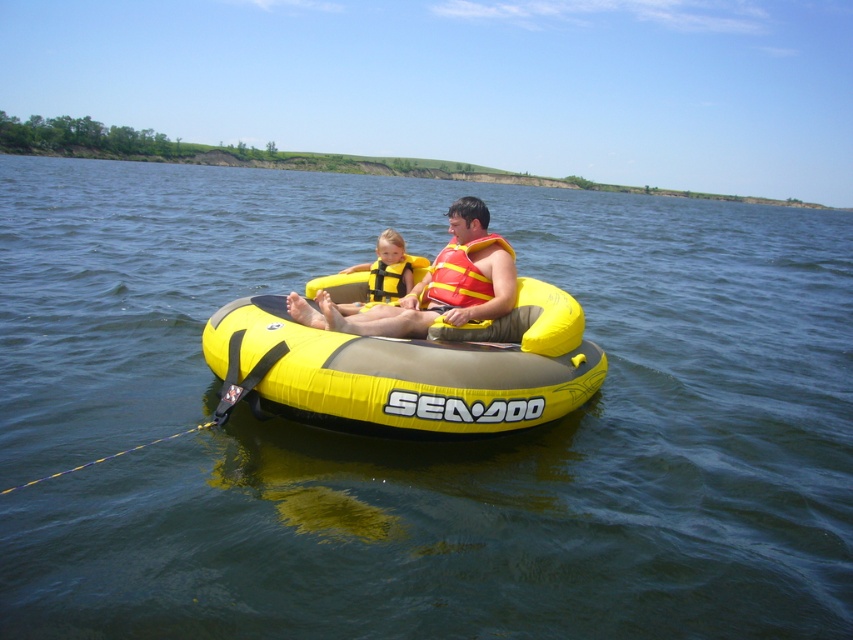
You are a lifeguard on duty and notice two people floating on a tube. You see the yellow life vest at center and the yellow fabric life jacket at center. Which one is closer to you?

The yellow life vest at center is closer to you because it is in front of the yellow fabric life jacket at center.